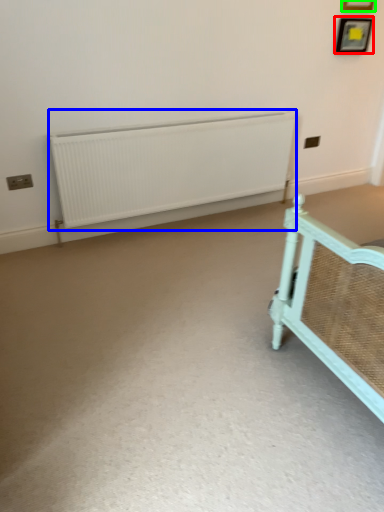
Question: Which is nearer to the picture frame (highlighted by a red box)? radiator (highlighted by a blue box) or picture frame (highlighted by a green box).

Choices:
 (A) radiator
 (B) picture frame

Answer: (B)